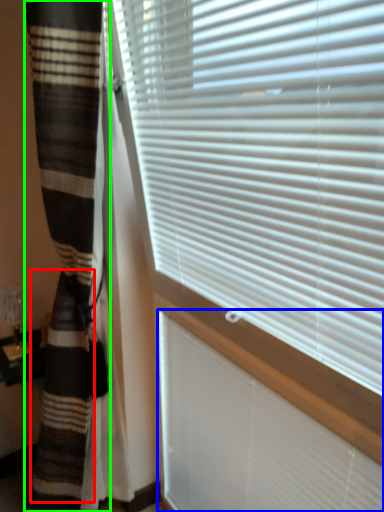
Question: Which object is positioned closest to blanket (highlighted by a red box)? Select from blind (highlighted by a blue box) and curtain (highlighted by a green box).

Choices:
 (A) blind
 (B) curtain

Answer: (B)